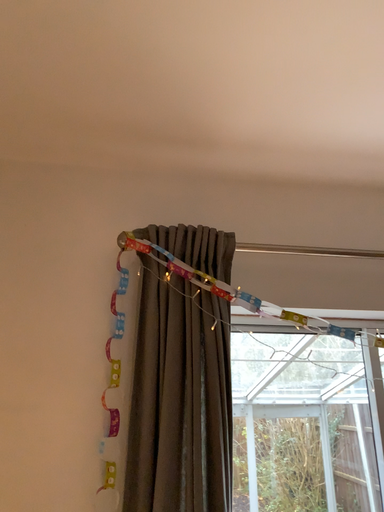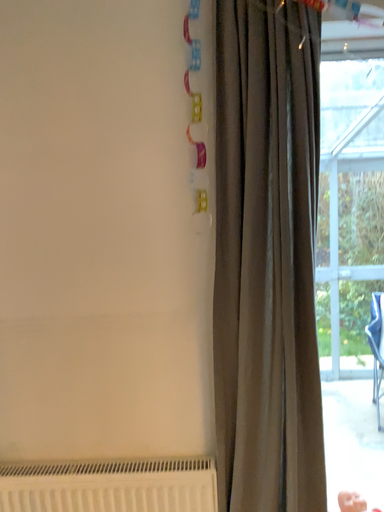
Question: How did the camera likely rotate when shooting the video?

Choices:
 (A) rotated left
 (B) rotated right

Answer: (A)